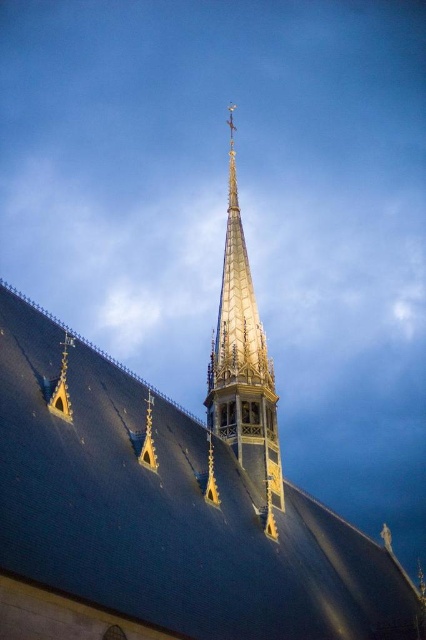
You are standing in a park across from the church. You want to take a photo of the shiny dark gray roof at center. The camera you have can focus on objects up to 30 meters away. Will the roof be in focus?

The shiny dark gray roof at center is 32.04 meters away from the viewer, which is beyond the camera focus range of 30 meters. Therefore, the roof will not be in focus.

You are standing in front of the church and want to take a photo that includes both point [114,516] and point [241,433]. Since you want the closer point to be in focus, which point should you focus on?

Point [114,516] is closer to the camera than point [241,433], so you should focus on point [114,516] to ensure it is in focus.